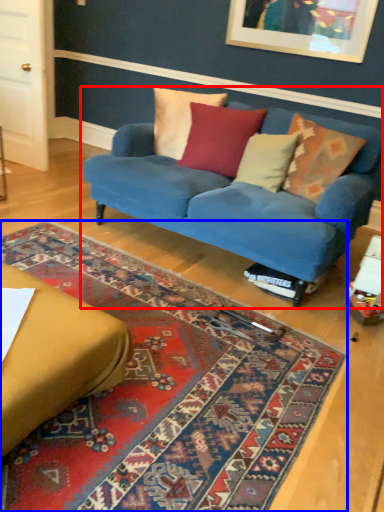
Question: Which object is further to the camera taking this photo, studio couch (highlighted by a red box) or mat (highlighted by a blue box)?

Choices:
 (A) studio couch
 (B) mat

Answer: (A)